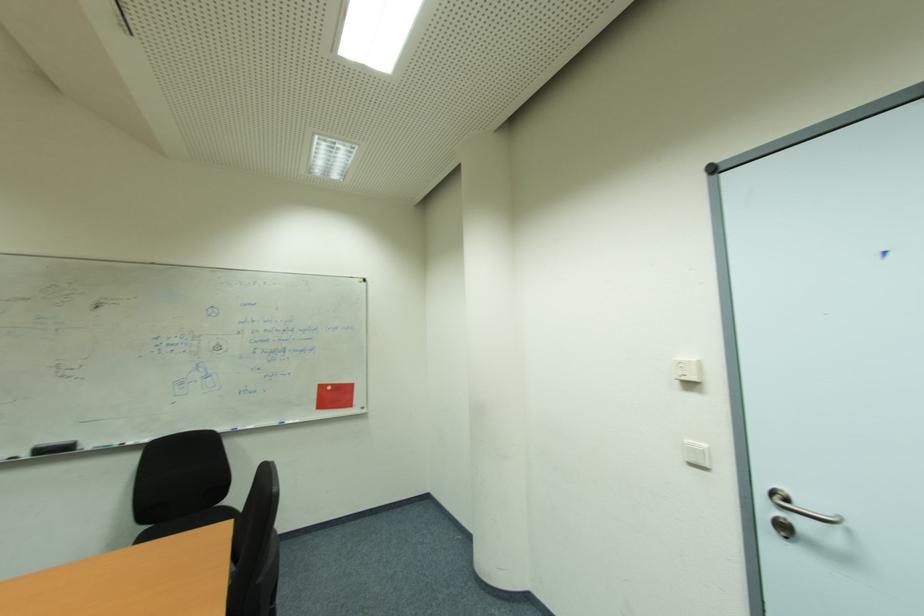
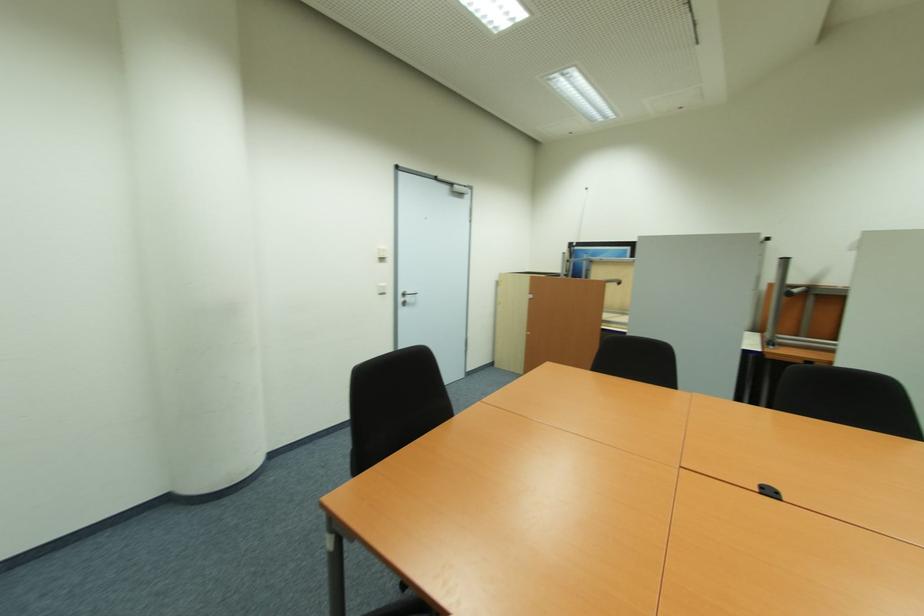
Find the pixel in the second image that matches (x=695, y=464) in the first image.

(383, 294)